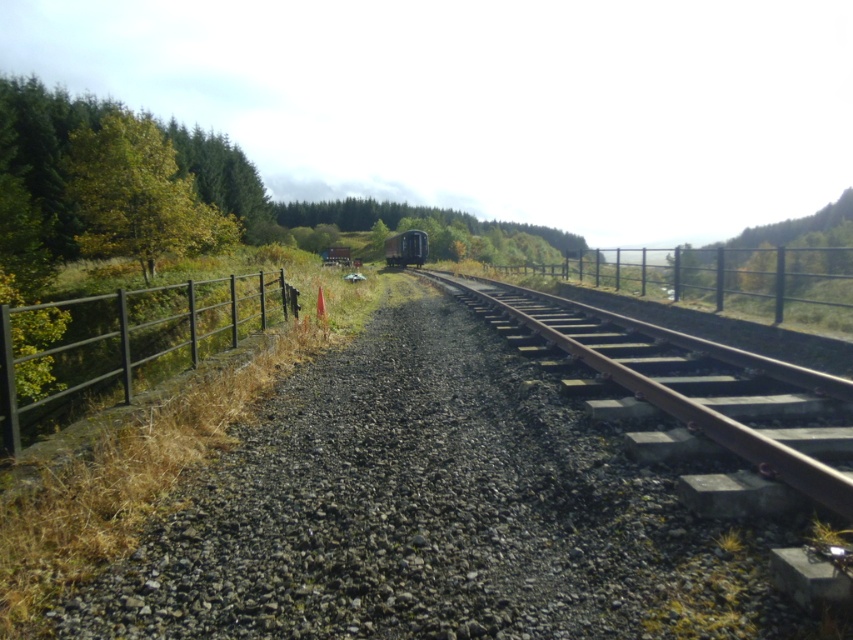
You are standing on the railway track and see a point marked at coordinates [131,340]. Based on the scene description, what object is located at that point?

The point at coordinates [131,340] indicates the black metal fence at left.

You are standing on the railway track and looking towards the direction the train is moving. Where is the black metal fence at left located relative to your position?

The black metal fence at left is located to the left side of the railway track, as its 2D coordinates at point (131, 340) place it on the left relative to the track centerline.